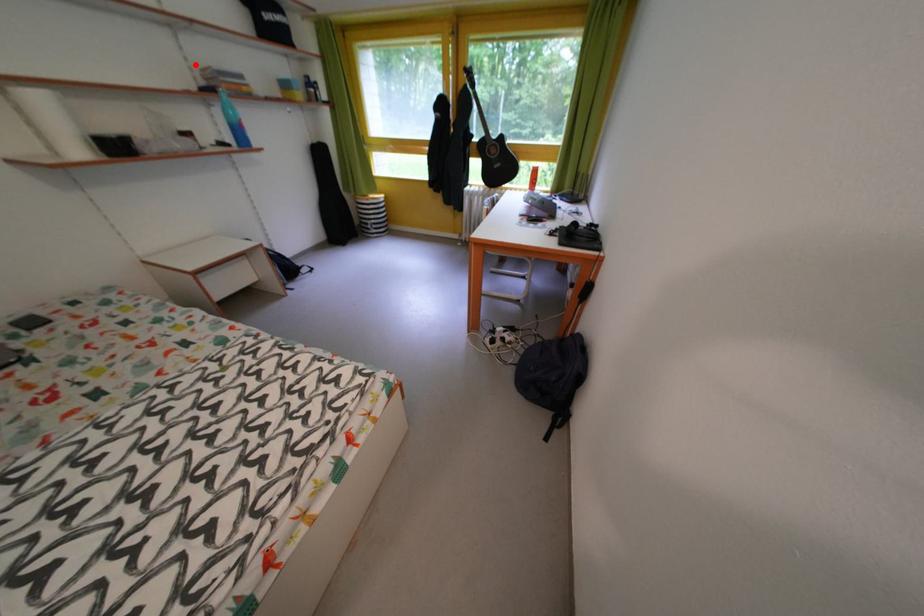
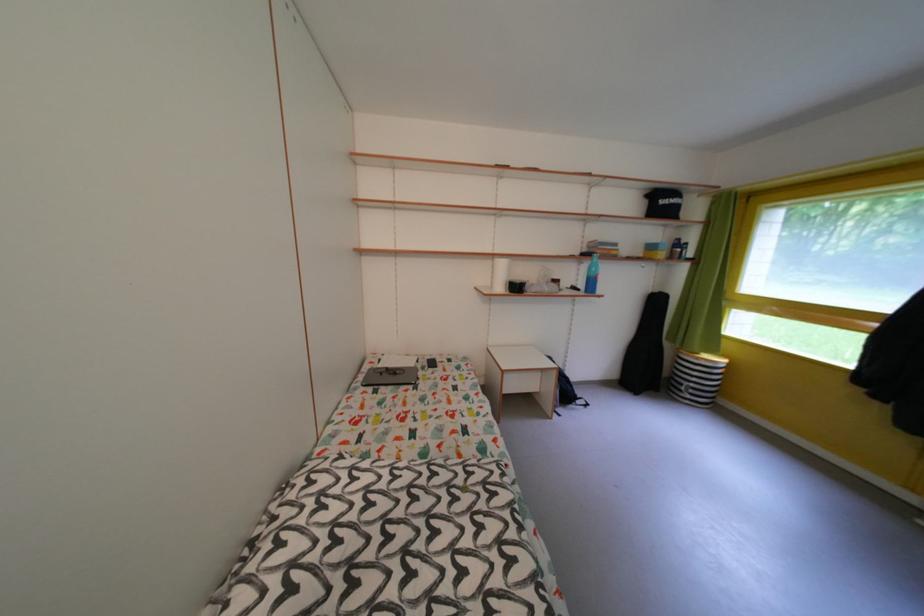
Find the pixel in the second image that matches the highlighted location in the first image.

(592, 243)